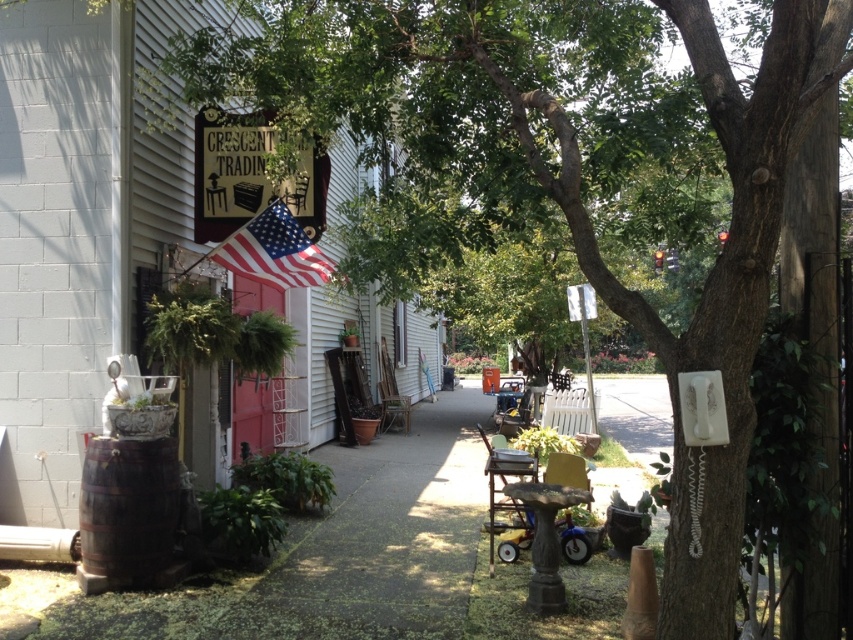
You are a customer approaching the entrance of the store and see two wooden signs. One is the wooden sign at center and the other is the wooden sign at upper center. Which sign should you look at first to find the store name?

The wooden sign at center is closer to the viewer than the wooden sign at upper center, so you should look at the wooden sign at center first to find the store name.

You are standing in front of the scene and want to take a photo. Which point, point (28, 493) or point (219, 195), would appear larger in your camera view?

Point (28, 493) is closer to the camera than point (219, 195), so it would appear larger in the photo.

You are a customer looking for the entrance to the store. You see the wooden sign at upper center and the american flag at upper left. Which object is closer to you, and therefore indicates the store entrance?

The wooden sign at upper center is closer to you, as it is in front of the american flag at upper left. This suggests the entrance is near the wooden sign at upper center.